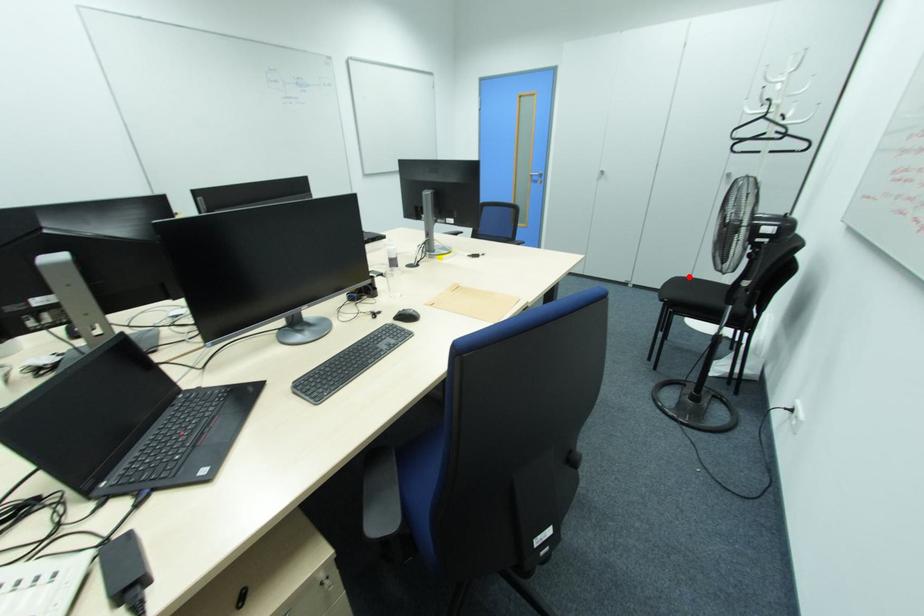
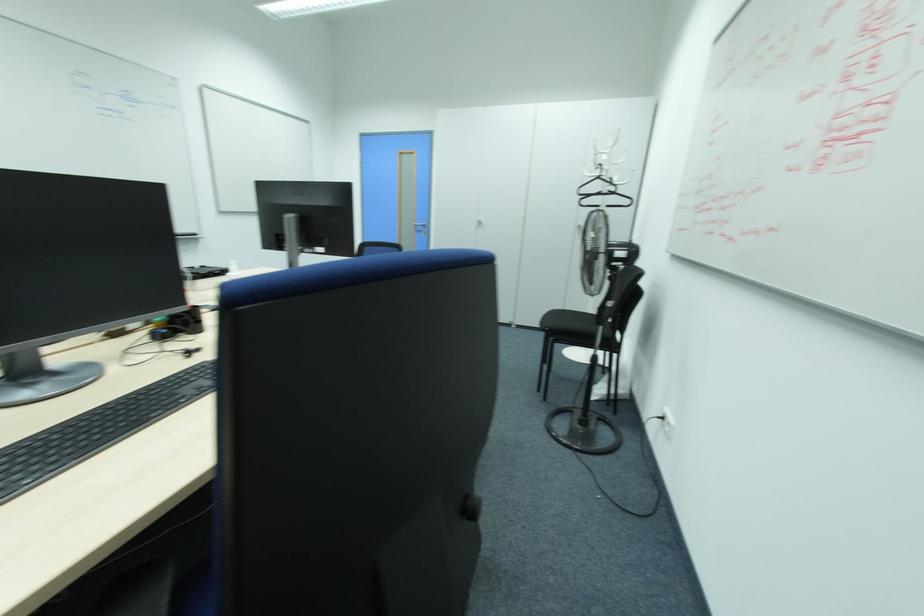
Question: I am providing you with two images of the same scene from different viewpoints. Image1 has a red point marked. In image2, the corresponding 3D location appears at what relative position? Reply with the corresponding letter.

Choices:
 (A) Closer
 (B) Farther

Answer: (B)